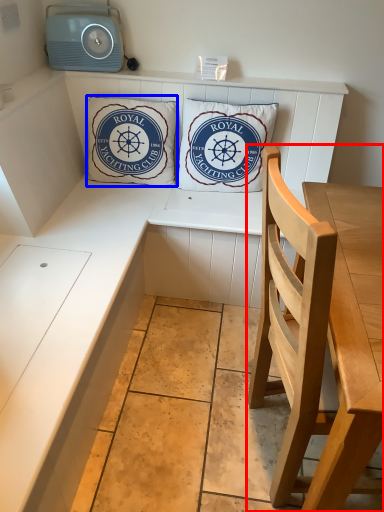
Question: Among these objects, which one is farthest to the camera, chair (highlighted by a red box) or pillow (highlighted by a blue box)?

Choices:
 (A) chair
 (B) pillow

Answer: (B)